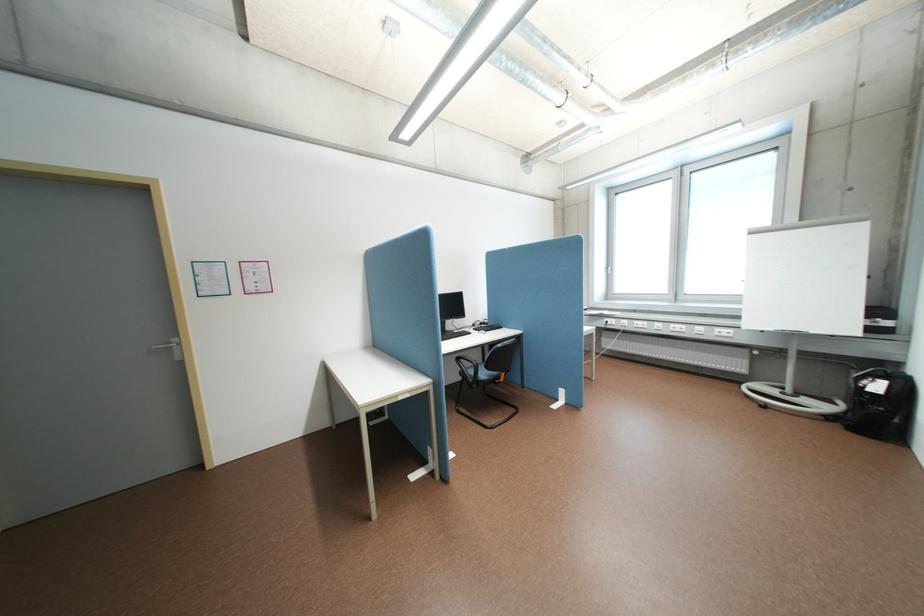
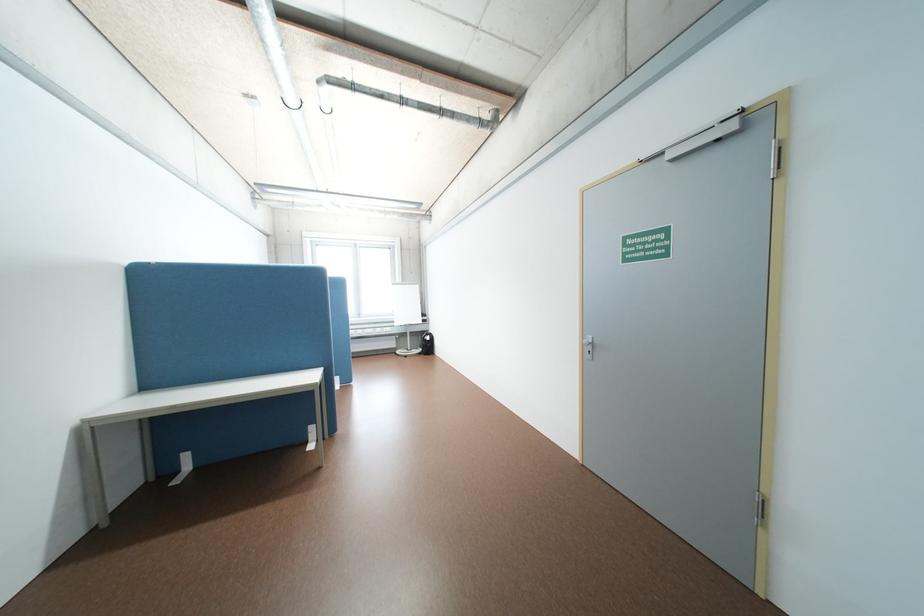
In the second image, find the point that corresponds to point (841, 418) in the first image.

(431, 353)